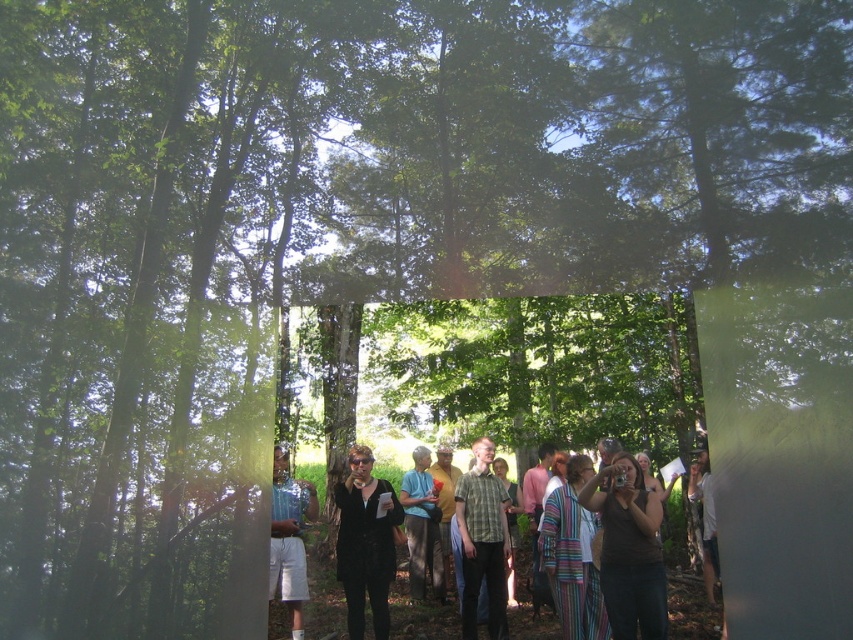
Can you confirm if matte black camera at center is positioned below light blue denim shorts at left?

Incorrect, matte black camera at center is not positioned below light blue denim shorts at left.

Between matte black camera at center and light blue denim shorts at left, which one appears on the right side from the viewer's perspective?

Positioned to the right is matte black camera at center.

Who is more distant from viewer, (x=630, y=499) or (x=303, y=556)?

Point (x=303, y=556)

Find the location of a particular element. Image resolution: width=853 pixels, height=640 pixels. matte black camera at center is located at coordinates (628, 548).

Is black matte blazer at center smaller than light blue denim shorts at left?

No.

Where is `black matte blazer at center`? black matte blazer at center is located at coordinates click(x=364, y=541).

You are a GUI agent. You are given a task and a screenshot of the screen. Output one action in this format:
    pyautogui.click(x=<x>, y=<y>)
    Task: Click on the black matte blazer at center
    
    Given the screenshot: What is the action you would take?
    pyautogui.click(x=364, y=541)

Between point (372, 620) and point (426, 573), which one is positioned behind?

Positioned behind is point (426, 573).

Measure the distance between point [370,525] and camera.

They are 3.79 meters apart.

Is point (341, 584) positioned behind point (430, 554)?

No.

Locate an element on the screen. black matte blazer at center is located at coordinates (364, 541).